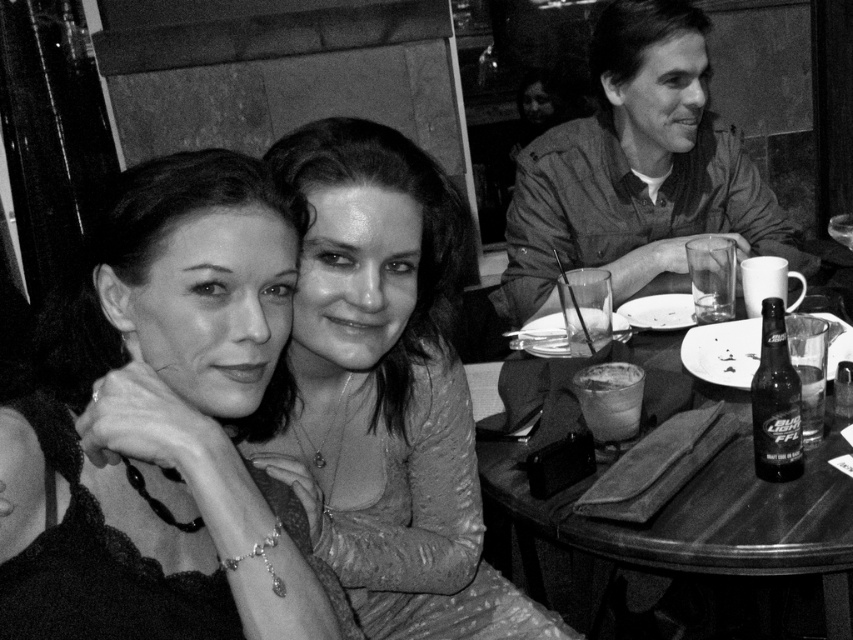
What is the texture of the area at the center of the image marked by point coordinates (163, 424)?

The area at point coordinates (163, 424) has smooth skin texture.

You are a photographer adjusting the lighting for a portrait. You notice the smooth skin at center and the smooth wooden table at center in the scene. Which object should you focus the light on if you want to highlight the texture of the surface closest to the camera?

The smooth skin at center is to the left of the smooth wooden table at center, meaning it is closer to the camera. Therefore, focusing the light on the smooth skin at center will best highlight the texture of the surface nearest the viewer.

You are a photographer adjusting the lighting in the dining area. You notice the matte khaki shirt at upper right and the smooth wooden table at center. Which object is covering part of the other?

The matte khaki shirt at upper right is positioned over the smooth wooden table at center, so the shirt is covering part of the table.